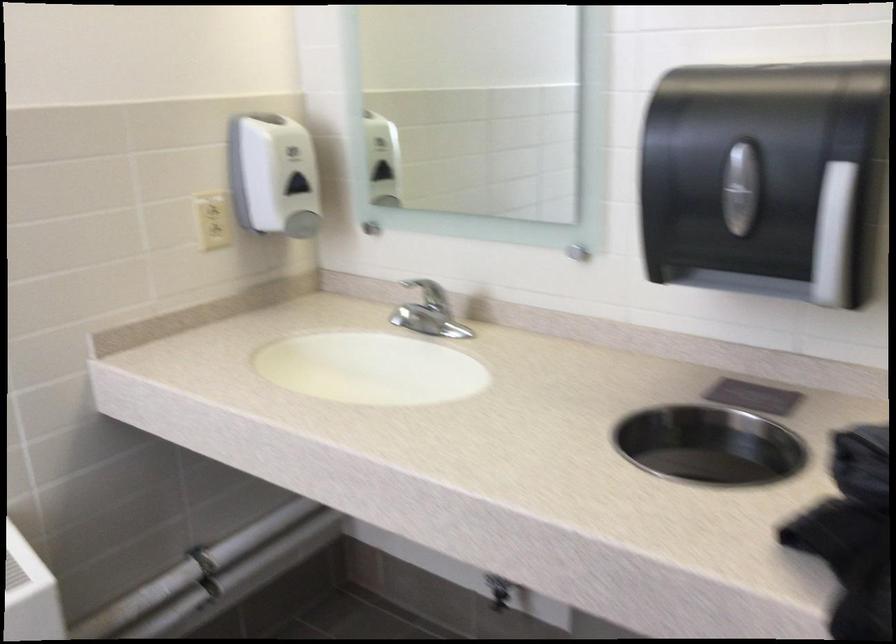
Where would you push the paper towel dispenser lever? Please return your answer as a coordinate pair (x, y).

(833, 236)